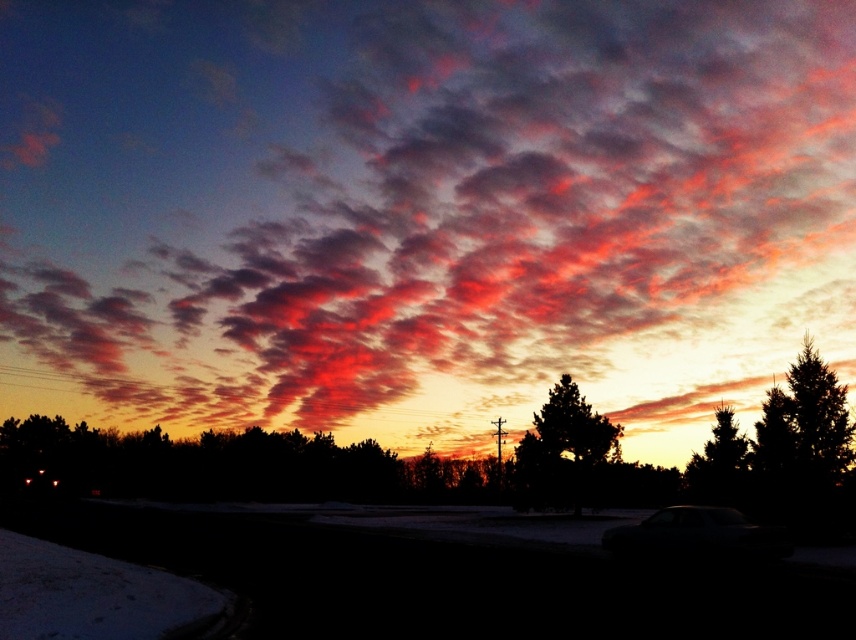
Does cloudy sky at upper center lie behind green leafy tree at right?

No.

Can you confirm if cloudy sky at upper center is thinner than green leafy tree at right?

In fact, cloudy sky at upper center might be wider than green leafy tree at right.

Is point (183, 417) closer to camera compared to point (730, 481)?

No.

Where is `cloudy sky at upper center`? cloudy sky at upper center is located at coordinates (421, 211).

How distant is dark green textured tree at center from dark gray metallic car at lower right?

66.74 feet

Is point (575, 492) positioned behind point (718, 547)?

Yes, it is.

This screenshot has width=856, height=640. What are the coordinates of `dark green textured tree at center` in the screenshot? It's located at (x=562, y=449).

You are a GUI agent. You are given a task and a screenshot of the screen. Output one action in this format:
    pyautogui.click(x=<x>, y=<y>)
    Task: Click on the dark green textured tree at center
    
    Given the screenshot: What is the action you would take?
    pyautogui.click(x=562, y=449)

Is cloudy sky at upper center thinner than dark green textured tree at center?

No.

Is cloudy sky at upper center to the right of dark green textured tree at center from the viewer's perspective?

No, cloudy sky at upper center is not to the right of dark green textured tree at center.

Does point (381, 390) come closer to viewer compared to point (522, 472)?

No, (381, 390) is further to viewer.

Find the location of `cloudy sky at upper center`. cloudy sky at upper center is located at coordinates (421, 211).